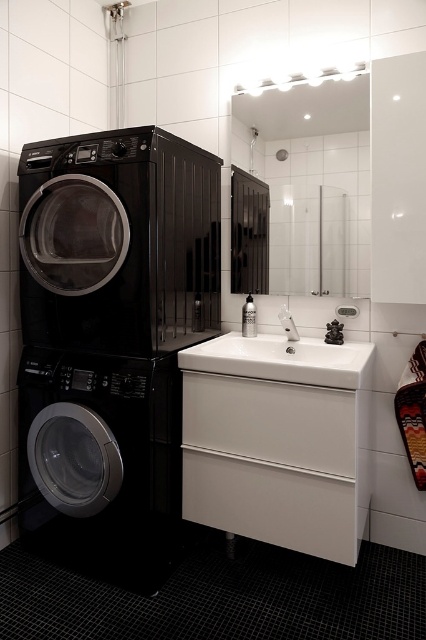
Can you confirm if black glossy washing machine at left is shorter than satin nickel faucet at sink center?

No, black glossy washing machine at left is not shorter than satin nickel faucet at sink center.

Is point (74, 556) in front of point (294, 337)?

Yes, it is.

Where is `black glossy washing machine at left`? The height and width of the screenshot is (640, 426). black glossy washing machine at left is located at coordinates (100, 461).

Does white matte drawer at lower center have a lesser width compared to white matte drawer at center?

No, white matte drawer at lower center is not thinner than white matte drawer at center.

Describe the element at coordinates (271, 502) in the screenshot. The width and height of the screenshot is (426, 640). I see `white matte drawer at lower center` at that location.

Where is `white matte drawer at lower center`? This screenshot has width=426, height=640. white matte drawer at lower center is located at coordinates (271, 502).

Find the location of a particular element. white matte drawer at lower center is located at coordinates (271, 502).

Which is behind, point (83, 355) or point (183, 444)?

Point (183, 444)

Who is lower down, black glossy washing machine at left or white matte drawer at center?

black glossy washing machine at left

Does point (57, 520) lie in front of point (271, 440)?

No, (57, 520) is further to viewer.

You are a GUI agent. You are given a task and a screenshot of the screen. Output one action in this format:
    pyautogui.click(x=<x>, y=<y>)
    Task: Click on the black glossy washing machine at left
    This screenshot has width=426, height=640.
    Given the screenshot: What is the action you would take?
    pyautogui.click(x=100, y=461)